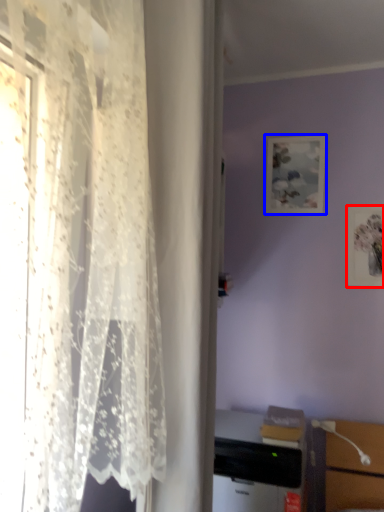
Question: Among these objects, which one is nearest to the camera, picture frame (highlighted by a red box) or picture frame (highlighted by a blue box)?

Choices:
 (A) picture frame
 (B) picture frame

Answer: (A)